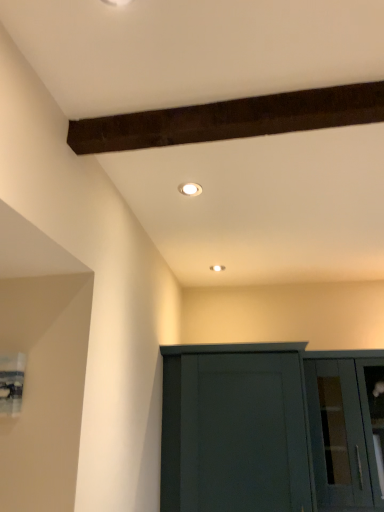
Question: Is the depth of transparent glass cabinet at lower right less than that of matte dark green cupboard at lower center?

Choices:
 (A) no
 (B) yes

Answer: (A)

Question: Considering the relative sizes of transparent glass cabinet at lower right and matte dark green cupboard at lower center in the image provided, is transparent glass cabinet at lower right bigger than matte dark green cupboard at lower center?

Choices:
 (A) no
 (B) yes

Answer: (A)

Question: From the image's perspective, is transparent glass cabinet at lower right located beneath matte dark green cupboard at lower center?

Choices:
 (A) yes
 (B) no

Answer: (A)

Question: Can you confirm if transparent glass cabinet at lower right is thinner than matte dark green cupboard at lower center?

Choices:
 (A) yes
 (B) no

Answer: (A)

Question: Is matte dark green cupboard at lower center at the back of transparent glass cabinet at lower right?

Choices:
 (A) no
 (B) yes

Answer: (A)

Question: Is transparent glass cabinet at lower right in contact with matte dark green cupboard at lower center?

Choices:
 (A) yes
 (B) no

Answer: (B)

Question: From the image's perspective, would you say white glossy light fixture at upper center is positioned over transparent glass cabinet at lower right?

Choices:
 (A) yes
 (B) no

Answer: (A)

Question: From a real-world perspective, is white glossy light fixture at upper center positioned over transparent glass cabinet at lower right based on gravity?

Choices:
 (A) no
 (B) yes

Answer: (B)

Question: Would you say white glossy light fixture at upper center is outside transparent glass cabinet at lower right?

Choices:
 (A) no
 (B) yes

Answer: (B)

Question: Would you say white glossy light fixture at upper center contains transparent glass cabinet at lower right?

Choices:
 (A) no
 (B) yes

Answer: (A)

Question: Can you confirm if white glossy light fixture at upper center is wider than transparent glass cabinet at lower right?

Choices:
 (A) no
 (B) yes

Answer: (A)

Question: From a real-world perspective, is white glossy light fixture at upper center below transparent glass cabinet at lower right?

Choices:
 (A) no
 (B) yes

Answer: (A)

Question: From the image's perspective, is white glossy light fixture at upper center located beneath matte dark green cupboard at lower center?

Choices:
 (A) yes
 (B) no

Answer: (B)